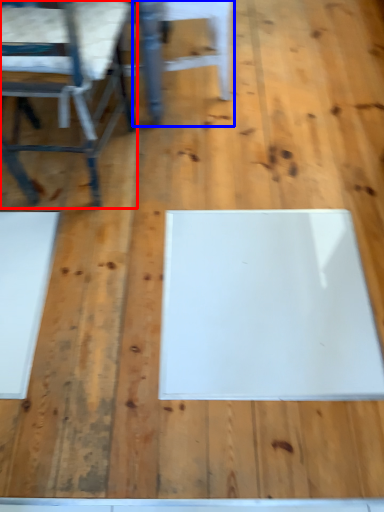
Question: Which point is closer to the camera, chair (highlighted by a red box) or chair (highlighted by a blue box)?

Choices:
 (A) chair
 (B) chair

Answer: (A)